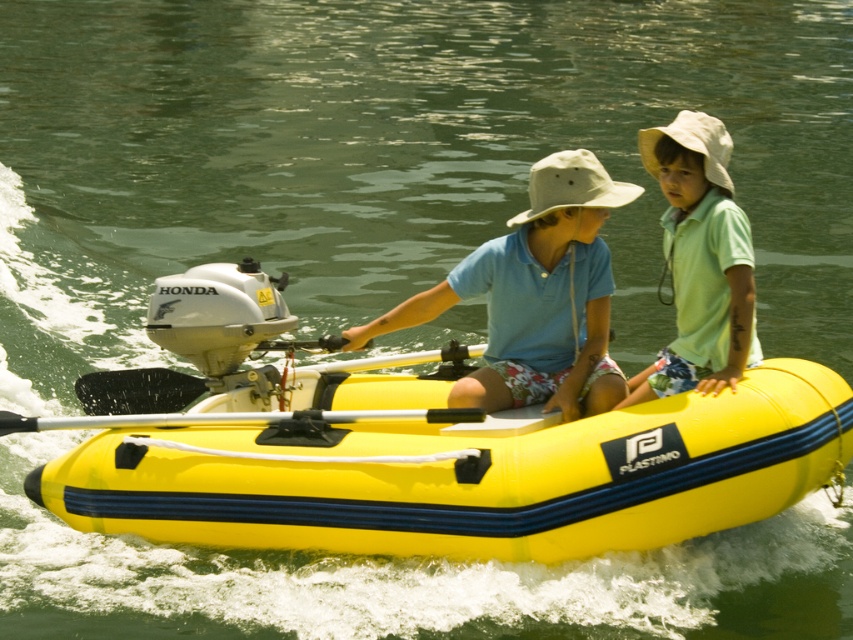
Question: Which of these objects is positioned closest to the white rubber paddle at center?

Choices:
 (A) matte blue shirt at center
 (B) silver metallic paddle at center
 (C) green matte shirt at upper right

Answer: (B)

Question: Which is farther from the green matte shirt at upper right?

Choices:
 (A) yellow rubber boat at center
 (B) matte blue shirt at center
 (C) silver metallic paddle at center
 (D) white rubber paddle at center

Answer: (D)

Question: Based on their relative distances, which object is farther from the matte blue shirt at center?

Choices:
 (A) white rubber paddle at center
 (B) yellow rubber boat at center
 (C) green matte shirt at upper right
 (D) silver metallic paddle at center

Answer: (A)

Question: Can you confirm if yellow rubber boat at center is bigger than white rubber paddle at center?

Choices:
 (A) no
 (B) yes

Answer: (B)

Question: Is matte blue shirt at center above silver metallic paddle at center?

Choices:
 (A) no
 (B) yes

Answer: (B)

Question: Does green matte shirt at upper right appear on the right side of white rubber paddle at center?

Choices:
 (A) yes
 (B) no

Answer: (A)